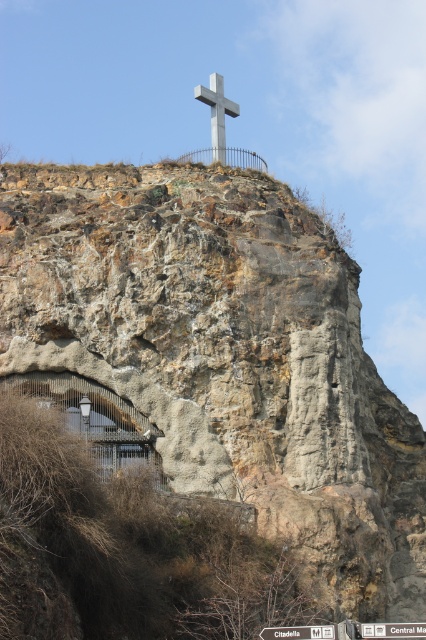
Question: In this image, where is white plastic signpost at upper center located relative to white plastic street sign at upper center?

Choices:
 (A) below
 (B) above

Answer: (B)

Question: Which object is farther from the camera taking this photo?

Choices:
 (A) white plastic signpost at upper center
 (B) white plastic street sign at upper center

Answer: (A)

Question: Which of the following is the closest to the observer?

Choices:
 (A) (394, 634)
 (B) (302, 636)
 (C) (212, 108)

Answer: (A)

Question: Can you confirm if white plastic signpost at upper center is positioned to the right of white plastic street sign at upper center?

Choices:
 (A) no
 (B) yes

Answer: (A)

Question: Considering the real-world distances, which object is closest to the white plastic street sign at upper center?

Choices:
 (A) metallic cross at upper center
 (B) white plastic signpost at upper center

Answer: (B)

Question: Observing the image, what is the correct spatial positioning of metallic cross at upper center in reference to white plastic street sign at upper center?

Choices:
 (A) below
 (B) above

Answer: (B)